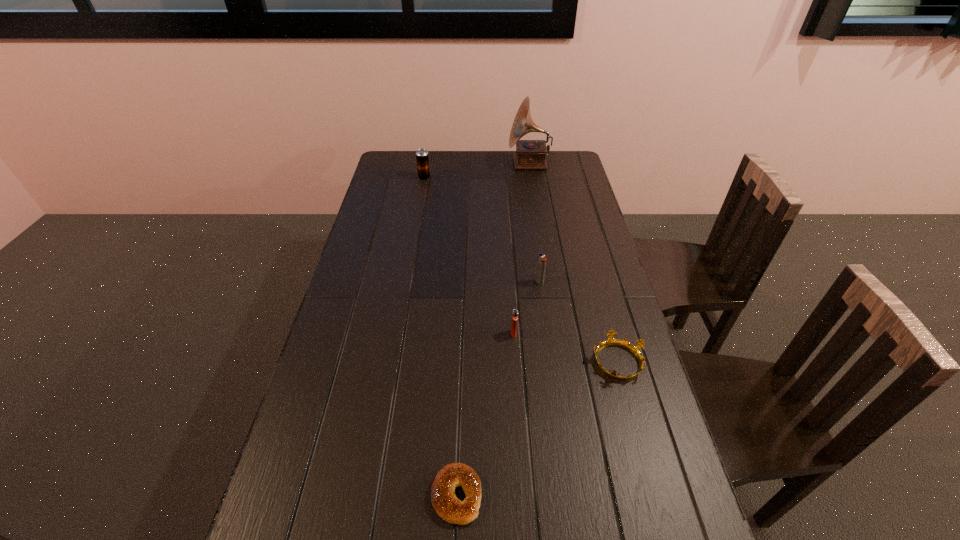
The width and height of the screenshot is (960, 540). I want to click on unoccupied area between the second nearest object and the nearest object, so click(537, 428).

Where is `vacant space in between the phonograph record and the right igniter`? Image resolution: width=960 pixels, height=540 pixels. vacant space in between the phonograph record and the right igniter is located at coordinates (534, 223).

Where is `free space between the phonograph record and the right igniter`? The width and height of the screenshot is (960, 540). free space between the phonograph record and the right igniter is located at coordinates (534, 223).

The width and height of the screenshot is (960, 540). In order to click on free point between the phonograph record and the shorter igniter in this screenshot , I will do `click(521, 248)`.

Where is `vacant area that lies between the shorter igniter and the crown`? vacant area that lies between the shorter igniter and the crown is located at coordinates (565, 347).

This screenshot has height=540, width=960. I want to click on vacant space in between the third nearest object and the fourth nearest object, so click(527, 308).

Where is `free space between the fourth object from right to left and the second shortest object`? This screenshot has height=540, width=960. free space between the fourth object from right to left and the second shortest object is located at coordinates (565, 347).

You are a GUI agent. You are given a task and a screenshot of the screen. Output one action in this format:
    pyautogui.click(x=<x>, y=<y>)
    Task: Click on the free area in between the leftmost object and the phonograph record
    Image resolution: width=960 pixels, height=540 pixels.
    Given the screenshot: What is the action you would take?
    pyautogui.click(x=477, y=171)

Locate which object ranks in proximity to the nearer igniter. Please provide its 2D coordinates. Your answer should be formatted as a tuple, i.e. [(x, y)], where the tuple contains the x and y coordinates of a point satisfying the conditions above.

[(635, 350)]

This screenshot has height=540, width=960. I want to click on the second closest object relative to the shortest object, so click(515, 312).